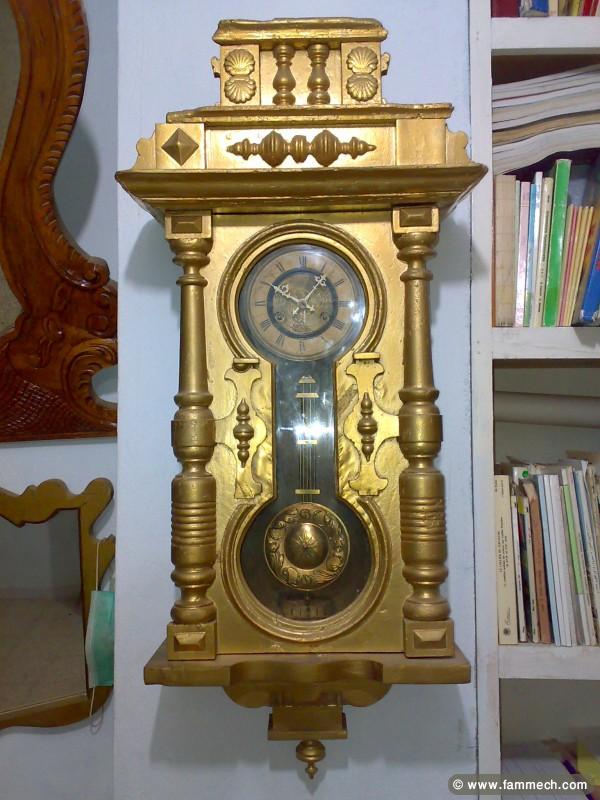
At what (x,y) coordinates should I click in order to perform the action: click on wall. Please return your answer as a coordinate pair (x, y). This screenshot has width=600, height=800. Looking at the image, I should click on (415, 52), (85, 462).